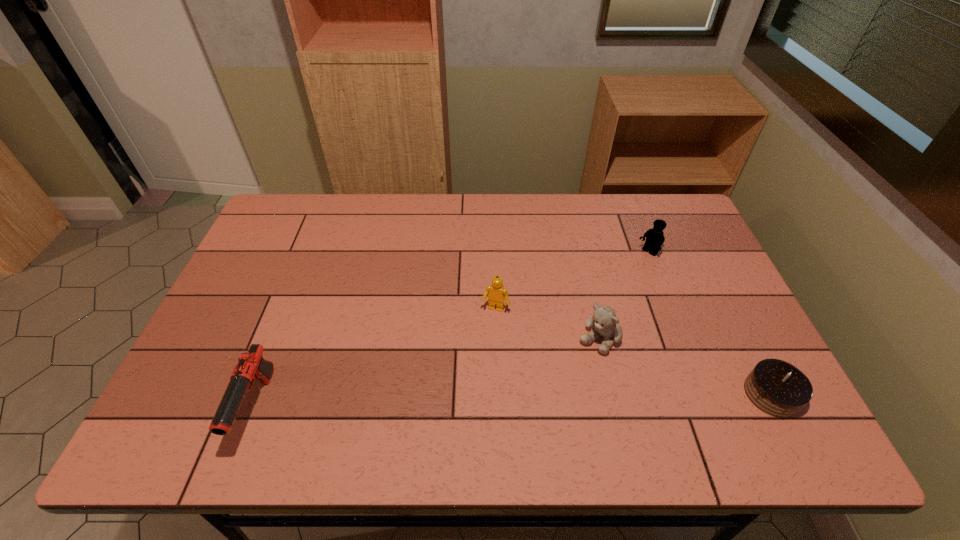
Where is `chocolate cake present at the near edge`? chocolate cake present at the near edge is located at coordinates (778, 388).

Find the location of a particular element. chocolate cake at the right edge is located at coordinates (778, 388).

You are a GUI agent. You are given a task and a screenshot of the screen. Output one action in this format:
    pyautogui.click(x=<x>, y=<y>)
    Task: Click on the Lego that is positioned at the right edge
    
    Given the screenshot: What is the action you would take?
    pyautogui.click(x=655, y=238)

This screenshot has width=960, height=540. I want to click on object at the near right corner, so click(778, 388).

This screenshot has height=540, width=960. In the image, there is a desktop. In order to click on vacant space at the far edge in this screenshot , I will do `click(443, 211)`.

Image resolution: width=960 pixels, height=540 pixels. In the image, there is a desktop. In order to click on vacant area at the near edge in this screenshot , I will do `click(303, 406)`.

In the image, there is a desktop. At what (x,y) coordinates should I click in order to perform the action: click on vacant space at the left edge. Please return your answer as a coordinate pair (x, y). Looking at the image, I should click on (268, 332).

Where is `free space at the right edge`? The image size is (960, 540). free space at the right edge is located at coordinates (725, 374).

The image size is (960, 540). What are the coordinates of `free region at the far left corner of the desktop` in the screenshot? It's located at (314, 199).

The height and width of the screenshot is (540, 960). In the image, there is a desktop. In order to click on vacant space at the near left corner in this screenshot , I will do `click(177, 395)`.